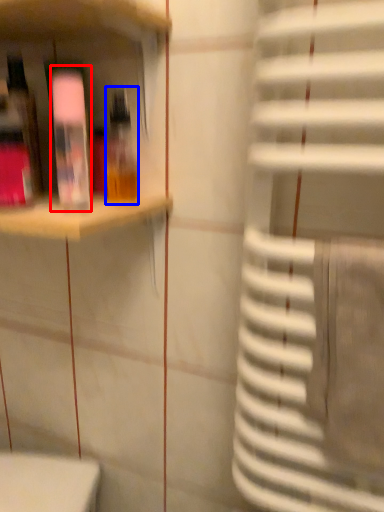
Question: Among these objects, which one is farthest to the camera, bottle (highlighted by a red box) or bottle (highlighted by a blue box)?

Choices:
 (A) bottle
 (B) bottle

Answer: (B)